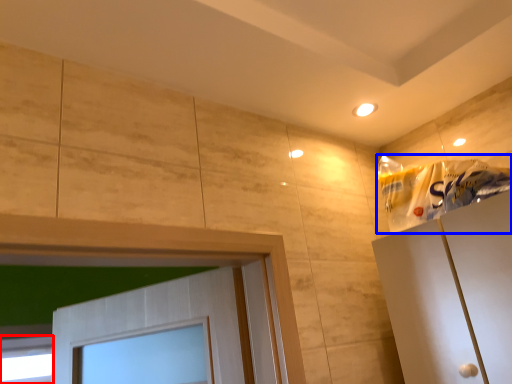
Question: Which object appears closest to the camera in this image, window (highlighted by a red box) or material (highlighted by a blue box)?

Choices:
 (A) window
 (B) material

Answer: (B)